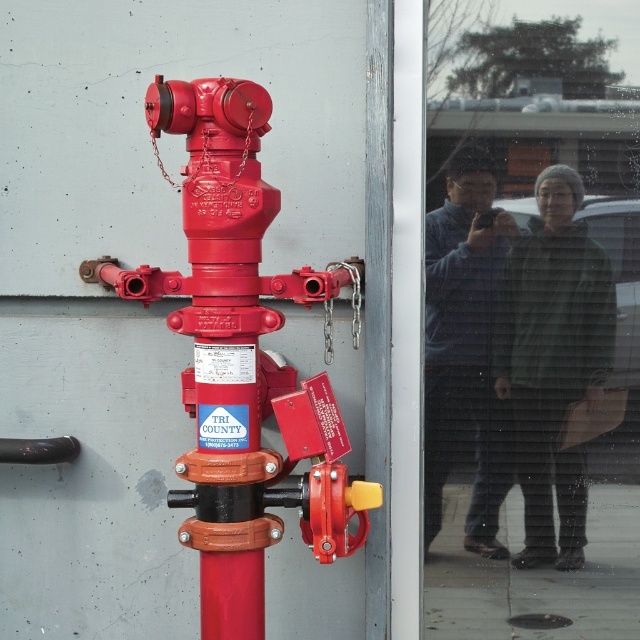
Is transparent glass door at upper right closer to camera compared to matte red fire hydrant at center?

No, it is behind matte red fire hydrant at center.

Who is more forward, (528,598) or (204,180)?

Point (204,180) is more forward.

Does point (426, 584) come in front of point (186, 500)?

No, it is not.

Locate an element on the screen. This screenshot has width=640, height=640. transparent glass door at upper right is located at coordinates (531, 378).